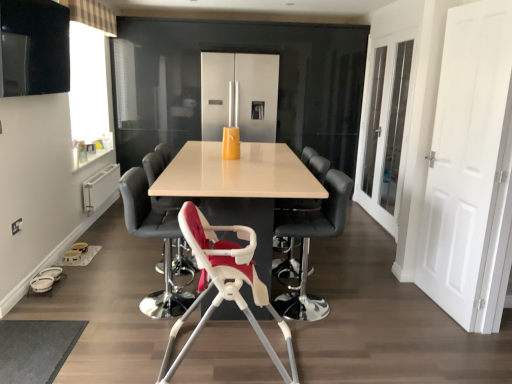
Where is `free area in between white matte door at right and white plastic highchair at center, placed as the first chair when sorted from front to back`? free area in between white matte door at right and white plastic highchair at center, placed as the first chair when sorted from front to back is located at coordinates (373, 328).